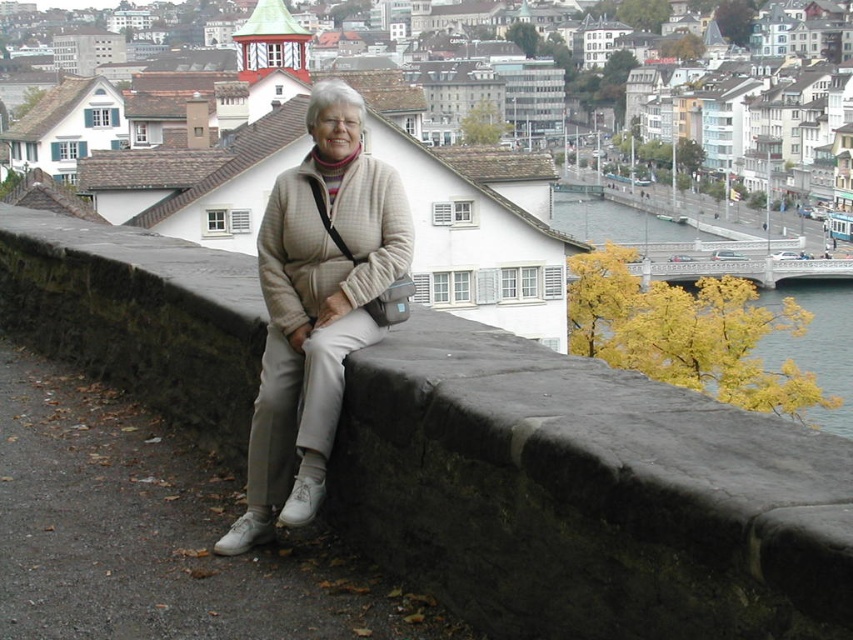
Question: Observing the image, what is the correct spatial positioning of beige woolen sweater at center in reference to yellow leafy tree at upper right?

Choices:
 (A) right
 (B) left

Answer: (B)

Question: Which point is closer to the camera taking this photo?

Choices:
 (A) (840, 323)
 (B) (424, 412)
 (C) (311, 424)

Answer: (B)

Question: Is dark gray stone ledge at center positioned behind yellow leafy tree at upper right?

Choices:
 (A) no
 (B) yes

Answer: (A)

Question: Does dark gray stone ledge at center have a lesser width compared to yellow leafy tree at upper right?

Choices:
 (A) no
 (B) yes

Answer: (B)

Question: Which is nearer to the beige woolen sweater at center?

Choices:
 (A) yellow leafy tree at upper right
 (B) dark gray stone ledge at center

Answer: (B)

Question: Which of these objects is positioned farthest from the dark gray stone ledge at center?

Choices:
 (A) beige woolen sweater at center
 (B) yellow leafy tree at upper right

Answer: (B)